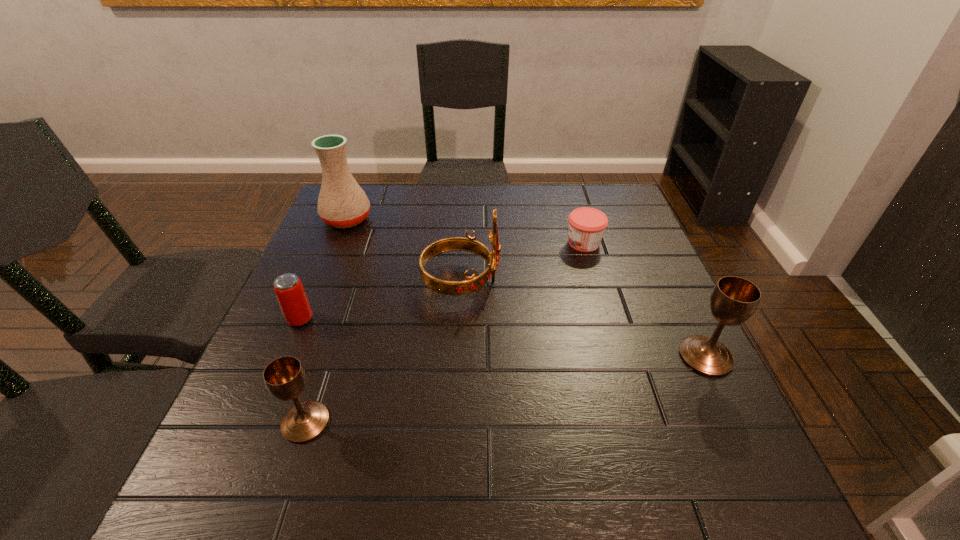
At what (x,y) coordinates should I click in order to perform the action: click on beer can. Please return your answer as a coordinate pair (x, y). This screenshot has width=960, height=540. Looking at the image, I should click on 288,288.

Image resolution: width=960 pixels, height=540 pixels. What are the coordinates of `free space located 0.280m on the right of the left chalice` in the screenshot? It's located at (484, 422).

Identify the location of free point located on the left of the taller chalice. The image size is (960, 540). (549, 356).

You are a GUI agent. You are given a task and a screenshot of the screen. Output one action in this format:
    pyautogui.click(x=<x>, y=<y>)
    Task: Click on the vacant region located 0.160m on the front-facing side of the third farthest object
    The height and width of the screenshot is (540, 960).
    Given the screenshot: What is the action you would take?
    pyautogui.click(x=565, y=281)

Find the location of `free location located 0.130m on the front label of the jam`. free location located 0.130m on the front label of the jam is located at coordinates (517, 243).

What are the coordinates of `blank space located on the front label of the jam` in the screenshot? It's located at (540, 243).

The height and width of the screenshot is (540, 960). Find the location of `vacant position located 0.210m on the front label of the jam`. vacant position located 0.210m on the front label of the jam is located at coordinates (488, 243).

You are a GUI agent. You are given a task and a screenshot of the screen. Output one action in this format:
    pyautogui.click(x=<x>, y=<y>)
    Task: Click on the blank space located 0.070m on the back of the pottery
    
    Given the screenshot: What is the action you would take?
    pyautogui.click(x=357, y=194)

This screenshot has width=960, height=540. In order to click on free space located on the back of the beer can in this screenshot , I will do `click(324, 260)`.

What are the coordinates of `object positioned at the far edge` in the screenshot? It's located at (342, 203).